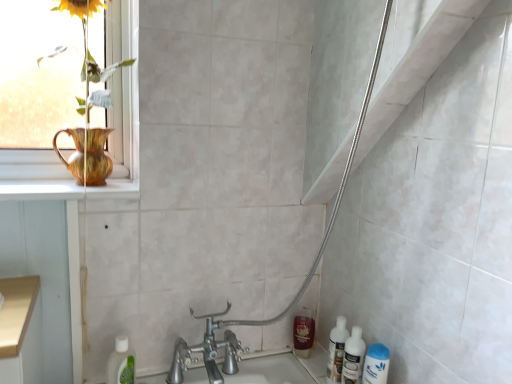
Question: Considering the relative positions of matte gold vase at upper left and white glossy mouthwash at lower right, which is counted as the 1th mouthwash, starting from the front, in the image provided, is matte gold vase at upper left to the right of white glossy mouthwash at lower right, which is counted as the 1th mouthwash, starting from the front, from the viewer's perspective?

Choices:
 (A) yes
 (B) no

Answer: (B)

Question: From the image's perspective, is matte gold vase at upper left on white glossy mouthwash at lower right, which is counted as the 1th mouthwash, starting from the front?

Choices:
 (A) no
 (B) yes

Answer: (B)

Question: From a real-world perspective, does matte gold vase at upper left stand above white glossy mouthwash at lower right, which is counted as the 1th mouthwash, starting from the front?

Choices:
 (A) no
 (B) yes

Answer: (B)

Question: From the image's perspective, is matte gold vase at upper left beneath white glossy mouthwash at lower right, arranged as the 2th mouthwash when viewed from the left?

Choices:
 (A) no
 (B) yes

Answer: (A)

Question: Can you confirm if matte gold vase at upper left is bigger than white glossy mouthwash at lower right, the 2th mouthwash viewed from the back?

Choices:
 (A) no
 (B) yes

Answer: (B)

Question: Would you say white glossy mouthwash at lower right, which is counted as the 1th mouthwash, starting from the front, is inside or outside clear plastic bottle at lower left, marked as the 1th cleaning product in a left-to-right arrangement?

Choices:
 (A) outside
 (B) inside

Answer: (A)

Question: From a real-world perspective, is white glossy mouthwash at lower right, the 2th mouthwash viewed from the back, above or below clear plastic bottle at lower left, marked as the 1th cleaning product in a left-to-right arrangement?

Choices:
 (A) above
 (B) below

Answer: (A)

Question: Considering their positions, is white glossy mouthwash at lower right, which is the 1th mouthwash from right to left, located in front of or behind clear plastic bottle at lower left, positioned as the second cleaning product in right-to-left order?

Choices:
 (A) behind
 (B) front

Answer: (B)

Question: Considering the relative positions of white glossy mouthwash at lower right, which is counted as the 1th mouthwash, starting from the front, and clear plastic bottle at lower left, positioned as the second cleaning product in right-to-left order, in the image provided, is white glossy mouthwash at lower right, which is counted as the 1th mouthwash, starting from the front, to the left or to the right of clear plastic bottle at lower left, positioned as the second cleaning product in right-to-left order,?

Choices:
 (A) left
 (B) right

Answer: (B)

Question: From a real-world perspective, is shiny brown bottle at lower right, the second mouthwash when ordered from front to back, positioned above or below translucent plastic bottles at lower right?

Choices:
 (A) below
 (B) above

Answer: (A)

Question: In the image, is shiny brown bottle at lower right, the 1th mouthwash from the back, positioned in front of or behind translucent plastic bottles at lower right?

Choices:
 (A) behind
 (B) front

Answer: (A)

Question: From the image's perspective, is shiny brown bottle at lower right, which is counted as the first mouthwash, starting from the left, positioned above or below translucent plastic bottles at lower right?

Choices:
 (A) below
 (B) above

Answer: (A)

Question: From their relative heights in the image, would you say shiny brown bottle at lower right, the 1th mouthwash from the back, is taller or shorter than translucent plastic bottles at lower right?

Choices:
 (A) tall
 (B) short

Answer: (B)

Question: Would you say shiny brown bottle at lower right, which is counted as the 2th mouthwash, starting from the right, is inside or outside white glossy mouthwash at lower right, which is counted as the 1th mouthwash, starting from the front?

Choices:
 (A) outside
 (B) inside

Answer: (A)

Question: Considering the positions of shiny brown bottle at lower right, the 1th mouthwash from the back, and white glossy mouthwash at lower right, arranged as the 2th mouthwash when viewed from the left, in the image, is shiny brown bottle at lower right, the 1th mouthwash from the back, taller or shorter than white glossy mouthwash at lower right, arranged as the 2th mouthwash when viewed from the left,?

Choices:
 (A) tall
 (B) short

Answer: (B)